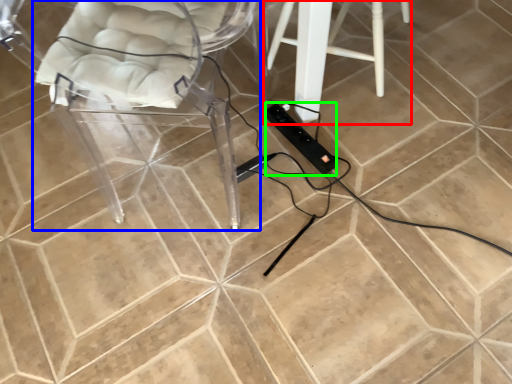
Question: Estimate the real-world distances between objects in this image. Which object is closer to furniture (highlighted by a red box), chair (highlighted by a blue box) or extension cord (highlighted by a green box)?

Choices:
 (A) chair
 (B) extension cord

Answer: (B)